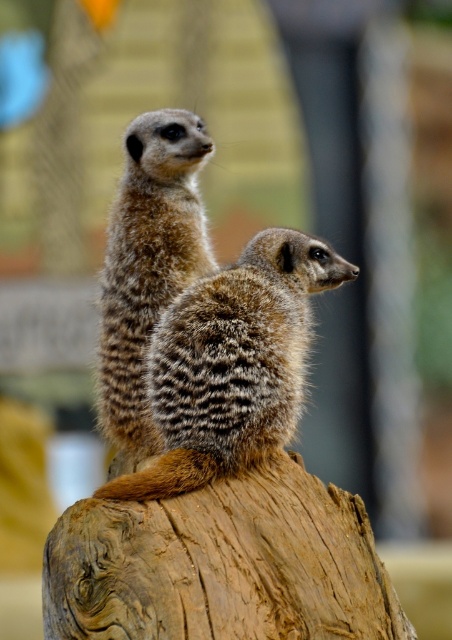
Can you confirm if brown fuzzy meerkat at center is positioned above fuzzy brown meerkat at upper left?

No.

Is brown fuzzy meerkat at center thinner than fuzzy brown meerkat at upper left?

Incorrect, brown fuzzy meerkat at center's width is not less than fuzzy brown meerkat at upper left's.

Is point (311, 244) less distant than point (116, 346)?

That is True.

Find the location of `brown fuzzy meerkat at center`. brown fuzzy meerkat at center is located at coordinates (231, 364).